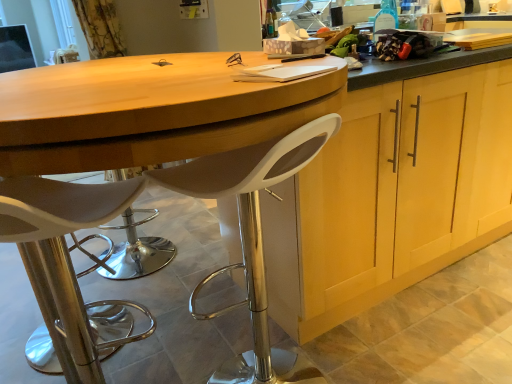
Locate an element on the screen. This screenshot has width=512, height=384. free spot behind white plastic stool at center, the first chair when ordered from right to left is located at coordinates (246, 327).